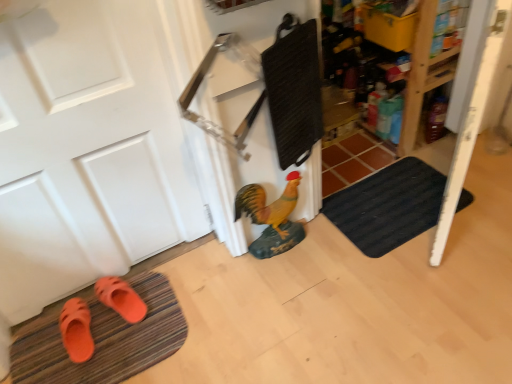
The height and width of the screenshot is (384, 512). I want to click on free spot below black textured bath mat at lower right, the second bath mat positioned from the left (from a real-world perspective), so (x=393, y=207).